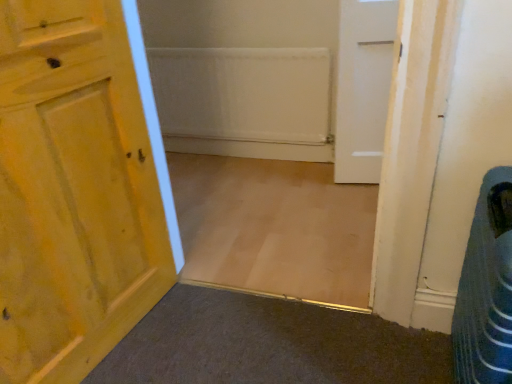
What do you see at coordinates (73, 191) in the screenshot? I see `wooden door at left, the 2th door in the back-to-front sequence` at bounding box center [73, 191].

Measure the distance between blue striped fabric laundry basket at lower right and camera.

blue striped fabric laundry basket at lower right and camera are 29.16 inches apart.

Identify the location of blue striped fabric laundry basket at lower right. (486, 289).

Where is `wooden door at left, the 2th door in the back-to-front sequence`? The image size is (512, 384). wooden door at left, the 2th door in the back-to-front sequence is located at coordinates (73, 191).

From their relative heights in the image, would you say wooden door at left, which is the 2th door in right-to-left order, is taller or shorter than white matte door at upper right, positioned as the 1th door in back-to-front order?

Clearly, wooden door at left, which is the 2th door in right-to-left order, is taller compared to white matte door at upper right, positioned as the 1th door in back-to-front order.

Is point (54, 319) closer or farther from the camera than point (378, 106)?

Point (54, 319).

From the image's perspective, which one is positioned lower, wooden door at left, which is the 2th door in right-to-left order, or white matte door at upper right, positioned as the 2th door in left-to-right order?

wooden door at left, which is the 2th door in right-to-left order, appears lower in the image.

Which object is wider, wooden door at left, which is counted as the 1th door, starting from the left, or white matte door at upper right, positioned as the 2th door in left-to-right order?

Wider between the two is wooden door at left, which is counted as the 1th door, starting from the left.

Does blue striped fabric laundry basket at lower right touch wooden door at left, which is the 2th door in right-to-left order?

blue striped fabric laundry basket at lower right and wooden door at left, which is the 2th door in right-to-left order, are clearly separated.

Between blue striped fabric laundry basket at lower right and wooden door at left, the 2th door in the back-to-front sequence, which one has smaller size?

Smaller between the two is blue striped fabric laundry basket at lower right.

This screenshot has width=512, height=384. I want to click on the 2nd door positioned above the blue striped fabric laundry basket at lower right (from a real-world perspective), so click(73, 191).

Based on their positions, is blue striped fabric laundry basket at lower right located to the left or right of wooden door at left, which is counted as the 1th door, starting from the left?

Clearly, blue striped fabric laundry basket at lower right is on the right of wooden door at left, which is counted as the 1th door, starting from the left, in the image.

Is blue striped fabric laundry basket at lower right oriented away from white matte door at upper right, which is the second door in front-to-back order?

No.

Is blue striped fabric laundry basket at lower right positioned far away from white matte door at upper right, positioned as the 1th door in back-to-front order?

Indeed, blue striped fabric laundry basket at lower right is not near white matte door at upper right, positioned as the 1th door in back-to-front order.

From a real-world perspective, is blue striped fabric laundry basket at lower right physically below white matte door at upper right, positioned as the 1th door in back-to-front order?

Yes, from a real-world perspective, blue striped fabric laundry basket at lower right is below white matte door at upper right, positioned as the 1th door in back-to-front order.

Does blue striped fabric laundry basket at lower right lie in front of white matte door at upper right, which is the second door in front-to-back order?

Yes.

Image resolution: width=512 pixels, height=384 pixels. What are the coordinates of `door that is the 1st object to the left of the blue striped fabric laundry basket at lower right, starting at the anchor` in the screenshot? It's located at (362, 88).

Considering the relative positions of white matte door at upper right, positioned as the 1th door in back-to-front order, and blue striped fabric laundry basket at lower right in the image provided, is white matte door at upper right, positioned as the 1th door in back-to-front order, to the left or to the right of blue striped fabric laundry basket at lower right?

Clearly, white matte door at upper right, positioned as the 1th door in back-to-front order, is on the left of blue striped fabric laundry basket at lower right in the image.

Is white matte door at upper right, the 1th door viewed from the right, taller or shorter than blue striped fabric laundry basket at lower right?

Clearly, white matte door at upper right, the 1th door viewed from the right, is taller compared to blue striped fabric laundry basket at lower right.

Is white matte door at upper right, positioned as the 2th door in left-to-right order, not within blue striped fabric laundry basket at lower right?

white matte door at upper right, positioned as the 2th door in left-to-right order, is positioned outside blue striped fabric laundry basket at lower right.

Which of these two, white matte door at upper right, positioned as the 2th door in left-to-right order, or wooden door at left, which is counted as the 1th door, starting from the left, is thinner?

With smaller width is white matte door at upper right, positioned as the 2th door in left-to-right order.

Could you measure the distance between white matte door at upper right, positioned as the 1th door in back-to-front order, and wooden door at left, positioned as the first door in front-to-back order?

1.24 meters.

Is white matte door at upper right, which is the second door in front-to-back order, inside or outside of wooden door at left, the 2th door in the back-to-front sequence?

white matte door at upper right, which is the second door in front-to-back order, is not inside wooden door at left, the 2th door in the back-to-front sequence, it's outside.

Considering the sizes of objects white matte door at upper right, which is the second door in front-to-back order, and wooden door at left, which is counted as the 1th door, starting from the left, in the image provided, who is taller, white matte door at upper right, which is the second door in front-to-back order, or wooden door at left, which is counted as the 1th door, starting from the left,?

wooden door at left, which is counted as the 1th door, starting from the left.

Is wooden door at left, which is counted as the 1th door, starting from the left, turned away from blue striped fabric laundry basket at lower right?

No, wooden door at left, which is counted as the 1th door, starting from the left, is not facing away from blue striped fabric laundry basket at lower right.

Can you tell me how much wooden door at left, which is counted as the 1th door, starting from the left, and blue striped fabric laundry basket at lower right differ in facing direction?

79.5 degrees.

Is point (151, 281) closer or farther from the camera than point (500, 245)?

Point (151, 281) is positioned farther from the camera compared to point (500, 245).

From the image's perspective, is wooden door at left, which is the 2th door in right-to-left order, under blue striped fabric laundry basket at lower right?

Incorrect, from the image's perspective, wooden door at left, which is the 2th door in right-to-left order, is higher than blue striped fabric laundry basket at lower right.

The height and width of the screenshot is (384, 512). In the image, there is a wooden door at left, which is the 2th door in right-to-left order. In order to click on door below it (from a real-world perspective) in this screenshot , I will do `click(362, 88)`.

Locate an element on the screen. laundry basket below the wooden door at left, the 2th door in the back-to-front sequence (from the image's perspective) is located at coordinates (486, 289).

Based on their spatial positions, is wooden door at left, which is counted as the 1th door, starting from the left, or white matte door at upper right, positioned as the 2th door in left-to-right order, further from blue striped fabric laundry basket at lower right?

white matte door at upper right, positioned as the 2th door in left-to-right order, is further to blue striped fabric laundry basket at lower right.

Considering their positions, is white matte door at upper right, which is the second door in front-to-back order, positioned closer to wooden door at left, positioned as the first door in front-to-back order, than blue striped fabric laundry basket at lower right?

Based on the image, blue striped fabric laundry basket at lower right appears to be nearer to wooden door at left, positioned as the first door in front-to-back order.

Looking at the image, which one is located closer to white matte door at upper right, the 1th door viewed from the right, wooden door at left, positioned as the first door in front-to-back order, or blue striped fabric laundry basket at lower right?

blue striped fabric laundry basket at lower right is positioned closer to the anchor white matte door at upper right, the 1th door viewed from the right.

Looking at the image, which one is located closer to blue striped fabric laundry basket at lower right, white matte door at upper right, positioned as the 2th door in left-to-right order, or wooden door at left, the 2th door in the back-to-front sequence?

wooden door at left, the 2th door in the back-to-front sequence.

Considering their positions, is blue striped fabric laundry basket at lower right positioned further to wooden door at left, the 2th door in the back-to-front sequence, than white matte door at upper right, the 1th door viewed from the right?

white matte door at upper right, the 1th door viewed from the right.

When comparing their distances from white matte door at upper right, which is the second door in front-to-back order, does blue striped fabric laundry basket at lower right or wooden door at left, the 2th door in the back-to-front sequence, seem further?

Based on the image, wooden door at left, the 2th door in the back-to-front sequence, appears to be further to white matte door at upper right, which is the second door in front-to-back order.

Where is `door between blue striped fabric laundry basket at lower right and white matte door at upper right, the 1th door viewed from the right, in the front-back direction`? Image resolution: width=512 pixels, height=384 pixels. door between blue striped fabric laundry basket at lower right and white matte door at upper right, the 1th door viewed from the right, in the front-back direction is located at coordinates (73, 191).